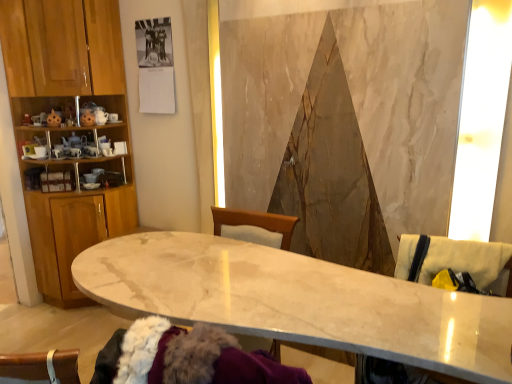
Question: Does marble table at center have a greater width compared to wooden cabinet at left?

Choices:
 (A) no
 (B) yes

Answer: (B)

Question: Is marble table at center facing away from wooden cabinet at left?

Choices:
 (A) yes
 (B) no

Answer: (B)

Question: Considering the relative positions of marble table at center and wooden cabinet at left in the image provided, is marble table at center to the right of wooden cabinet at left from the viewer's perspective?

Choices:
 (A) yes
 (B) no

Answer: (A)

Question: From a real-world perspective, does marble table at center stand above wooden cabinet at left?

Choices:
 (A) yes
 (B) no

Answer: (B)

Question: Can you confirm if marble table at center is bigger than wooden cabinet at left?

Choices:
 (A) yes
 (B) no

Answer: (A)

Question: From the image's perspective, relative to beige fabric swivel chair at right, which is the 1th swivel chair from bottom to top, is beige fabric swivel chair at right, which ranks as the first swivel chair in top-to-bottom order, above or below?

Choices:
 (A) below
 (B) above

Answer: (B)

Question: Considering their positions, is beige fabric swivel chair at right, the second swivel chair when ordered from bottom to top, located in front of or behind beige fabric swivel chair at right, which is the 1th swivel chair from bottom to top?

Choices:
 (A) front
 (B) behind

Answer: (B)

Question: In the image, is beige fabric swivel chair at right, which ranks as the first swivel chair in top-to-bottom order, on the left side or the right side of beige fabric swivel chair at right, the second swivel chair in the top-to-bottom sequence?

Choices:
 (A) left
 (B) right

Answer: (B)

Question: From a real-world perspective, relative to beige fabric swivel chair at right, the second swivel chair in the top-to-bottom sequence, is beige fabric swivel chair at right, the second swivel chair when ordered from bottom to top, vertically above or below?

Choices:
 (A) below
 (B) above

Answer: (B)

Question: From the image's perspective, is beige fabric swivel chair at right, the second swivel chair when ordered from bottom to top, above or below wooden cabinet at left?

Choices:
 (A) below
 (B) above

Answer: (A)

Question: Considering the positions of beige fabric swivel chair at right, which ranks as the first swivel chair in top-to-bottom order, and wooden cabinet at left in the image, is beige fabric swivel chair at right, which ranks as the first swivel chair in top-to-bottom order, taller or shorter than wooden cabinet at left?

Choices:
 (A) short
 (B) tall

Answer: (A)

Question: Is beige fabric swivel chair at right, which ranks as the first swivel chair in top-to-bottom order, wider or thinner than wooden cabinet at left?

Choices:
 (A) wide
 (B) thin

Answer: (B)

Question: In the image, is beige fabric swivel chair at right, which ranks as the first swivel chair in top-to-bottom order, on the left side or the right side of wooden cabinet at left?

Choices:
 (A) left
 (B) right

Answer: (B)

Question: Based on their sizes in the image, would you say beige fabric swivel chair at right, the second swivel chair in the top-to-bottom sequence, is bigger or smaller than wooden cabinet at left?

Choices:
 (A) small
 (B) big

Answer: (A)

Question: In terms of height, does beige fabric swivel chair at right, the second swivel chair in the top-to-bottom sequence, look taller or shorter compared to wooden cabinet at left?

Choices:
 (A) short
 (B) tall

Answer: (A)